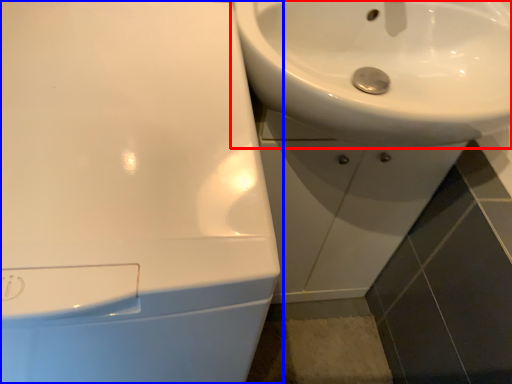
Question: Which point is closer to the camera, sink (highlighted by a red box) or sink (highlighted by a blue box)?

Choices:
 (A) sink
 (B) sink

Answer: (B)